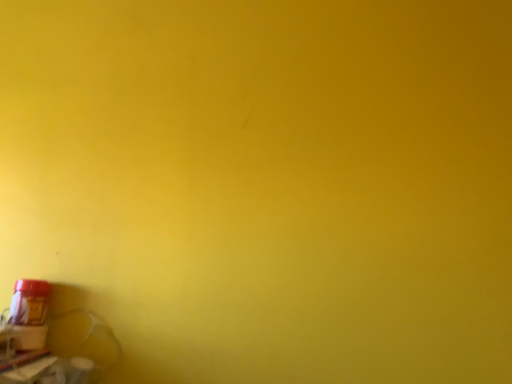
Question: Is matte plastic window sill at lower left situated inside matte red plastic bottle at bottom left or outside?

Choices:
 (A) inside
 (B) outside

Answer: (B)

Question: Is point (48, 357) positioned closer to the camera than point (40, 340)?

Choices:
 (A) closer
 (B) farther

Answer: (A)

Question: Considering their positions, is matte plastic window sill at lower left located in front of or behind matte red plastic bottle at bottom left?

Choices:
 (A) behind
 (B) front

Answer: (B)

Question: Considering their positions, is matte red plastic bottle at bottom left located in front of or behind matte plastic window sill at lower left?

Choices:
 (A) front
 (B) behind

Answer: (B)

Question: In terms of width, does matte red plastic bottle at bottom left look wider or thinner when compared to matte plastic window sill at lower left?

Choices:
 (A) wide
 (B) thin

Answer: (B)

Question: Is matte red plastic bottle at bottom left to the left or to the right of matte plastic window sill at lower left in the image?

Choices:
 (A) left
 (B) right

Answer: (B)

Question: Does point (9, 311) appear closer or farther from the camera than point (10, 380)?

Choices:
 (A) farther
 (B) closer

Answer: (A)